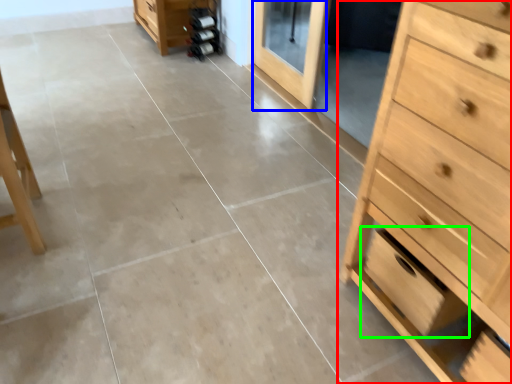
Question: Considering the real-world distances, which object is farthest from chest of drawers (highlighted by a red box)? screen door (highlighted by a blue box) or drawer (highlighted by a green box)?

Choices:
 (A) screen door
 (B) drawer

Answer: (A)